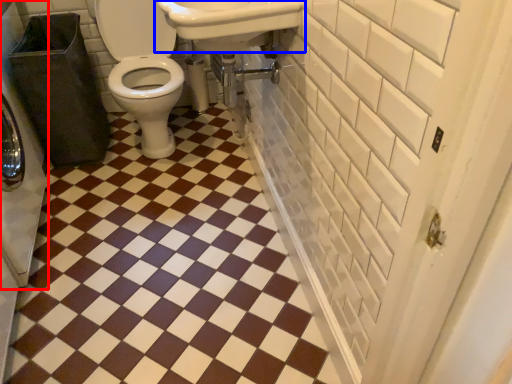
Question: Which object appears closest to the camera in this image, washer (highlighted by a red box) or sink (highlighted by a blue box)?

Choices:
 (A) washer
 (B) sink

Answer: (B)